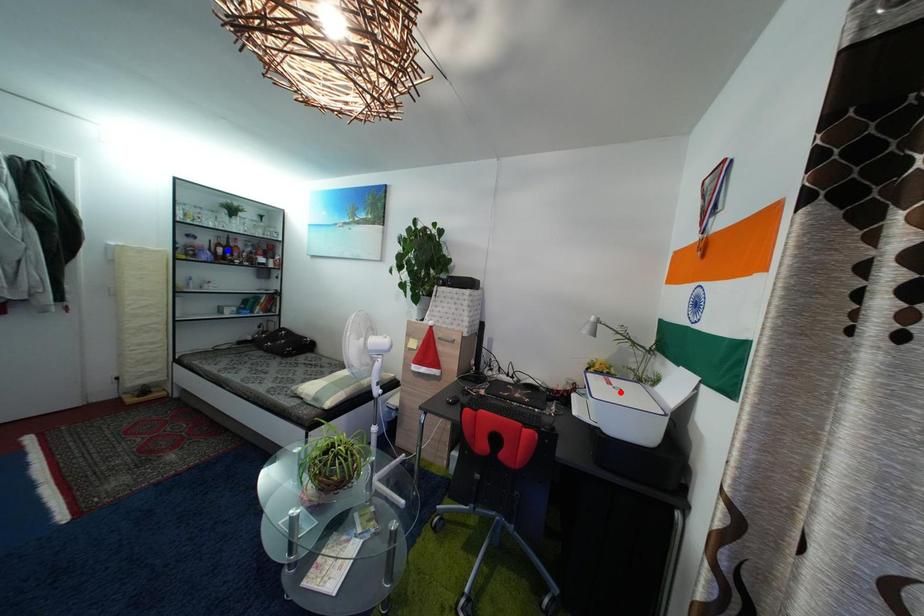
Question: Two points are marked on the image. Which point is closer to the camera?

Choices:
 (A) Blue point is closer.
 (B) Red point is closer.

Answer: (B)